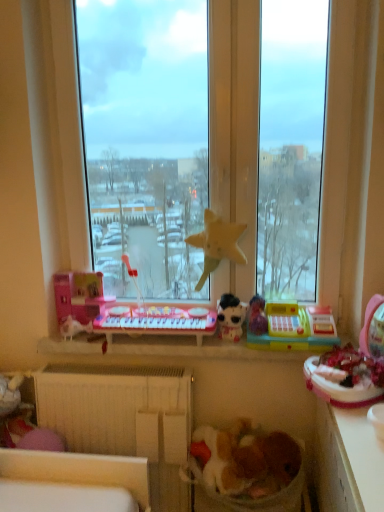
This screenshot has width=384, height=512. Find the location of `vacant space situated above white plastic toys at center (from a real-world perspective)`. vacant space situated above white plastic toys at center (from a real-world perspective) is located at coordinates (185, 345).